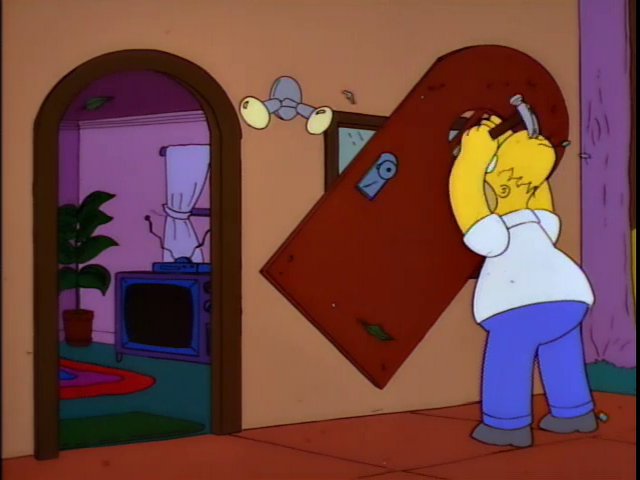
Where is `television`? This screenshot has height=480, width=640. television is located at coordinates (159, 316).